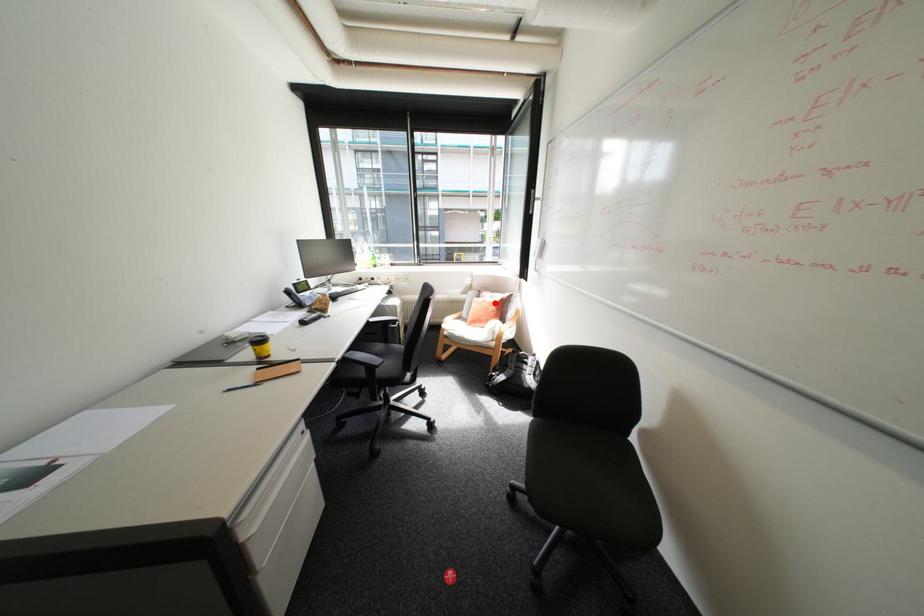
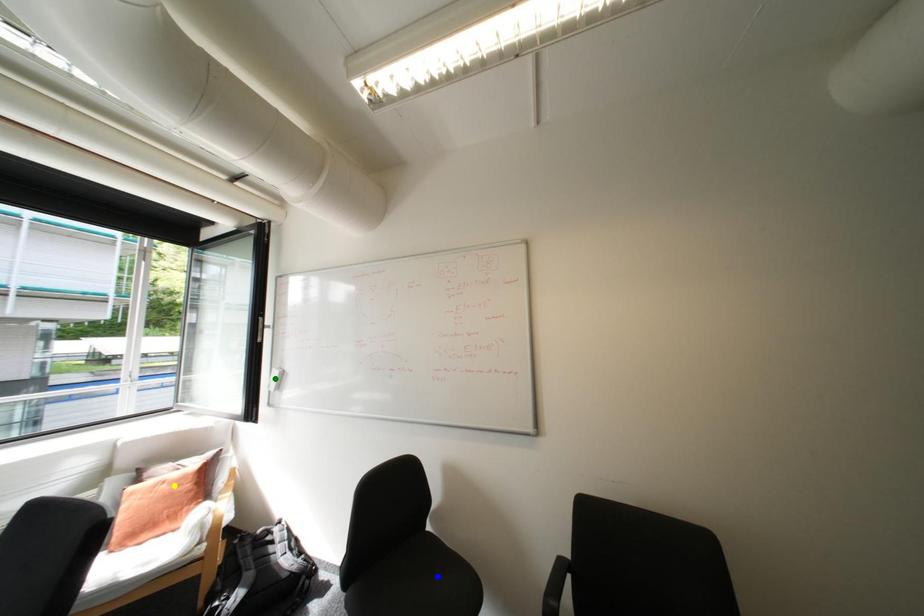
Question: I am providing you with two images of the same scene from different viewpoints. A red point is marked on the first image. You are given multiple points on the second image. Which point in image 2 is actually the same real-world point as the red point in image 1?

Choices:
 (A) blue point
 (B) green point
 (C) yellow point

Answer: (C)